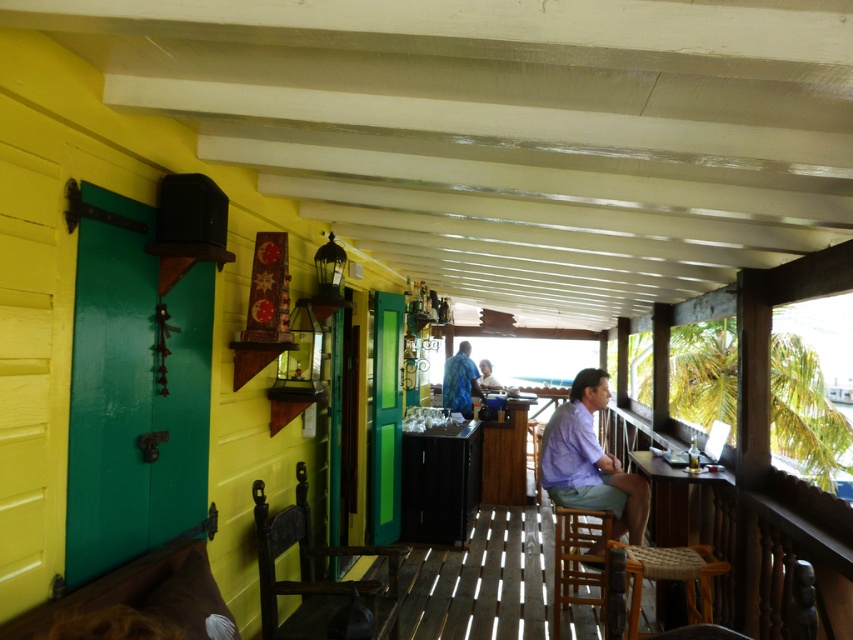
Question: Is woven straw stool at center further to camera compared to light brown wooden chair at center?

Choices:
 (A) no
 (B) yes

Answer: (A)

Question: Can you confirm if purple cotton shirt at center is bigger than wooden stool at lower right?

Choices:
 (A) yes
 (B) no

Answer: (B)

Question: Which point is farther from the camera taking this photo?

Choices:
 (A) (584, 397)
 (B) (390, 564)

Answer: (A)

Question: Which point appears farthest from the camera in this image?

Choices:
 (A) (305, 532)
 (B) (457, 355)
 (C) (637, 596)
 (D) (584, 516)

Answer: (B)

Question: Is purple cotton shirt at center to the left of woven straw stool at center from the viewer's perspective?

Choices:
 (A) yes
 (B) no

Answer: (A)

Question: Which object appears closest to the camera in this image?

Choices:
 (A) wooden stool at lower right
 (B) light brown wooden chair at center
 (C) wooden chair at left

Answer: (C)